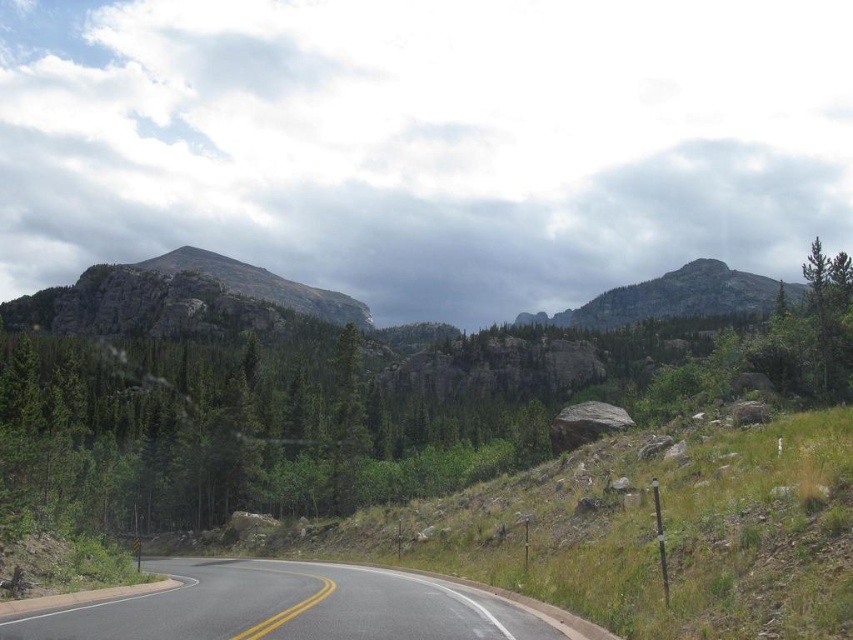
Question: Can you confirm if green matte tree at center is wider than rugged granite mountain at upper right?

Choices:
 (A) yes
 (B) no

Answer: (B)

Question: Among these objects, which one is nearest to the camera?

Choices:
 (A) rugged granite mountain at center
 (B) asphalt road at center
 (C) green matte tree at center

Answer: (B)

Question: Which object is the farthest from the green matte tree at center?

Choices:
 (A) rugged granite mountain at upper right
 (B) rugged granite mountain at center

Answer: (A)

Question: Which of the following is the closest to the observer?

Choices:
 (A) (361, 445)
 (B) (352, 598)
 (C) (651, 317)
 (D) (184, 314)

Answer: (B)

Question: Is green matte tree at center positioned at the back of rugged granite mountain at center?

Choices:
 (A) yes
 (B) no

Answer: (B)

Question: Considering the relative positions of green matte tree at center and rugged granite mountain at center in the image provided, where is green matte tree at center located with respect to rugged granite mountain at center?

Choices:
 (A) below
 (B) above

Answer: (A)